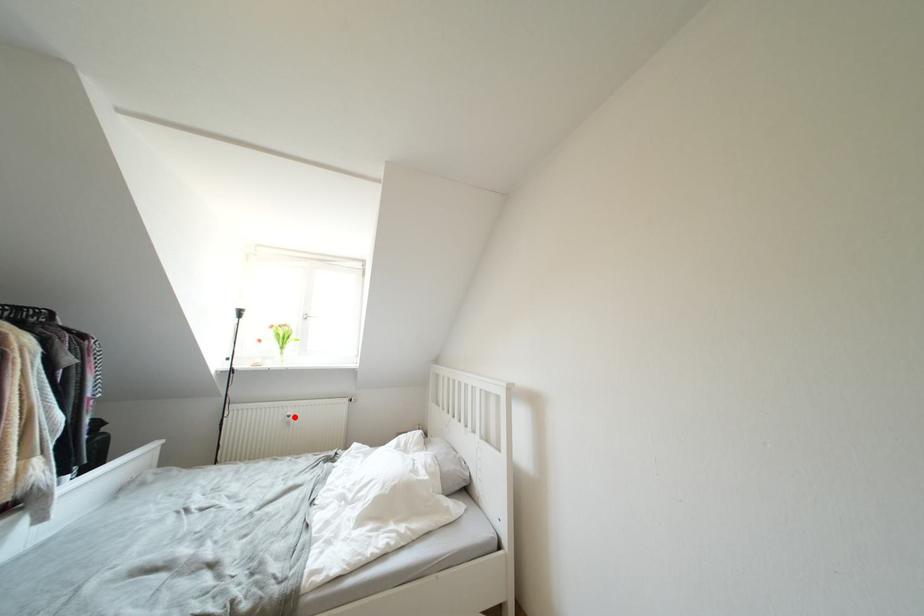
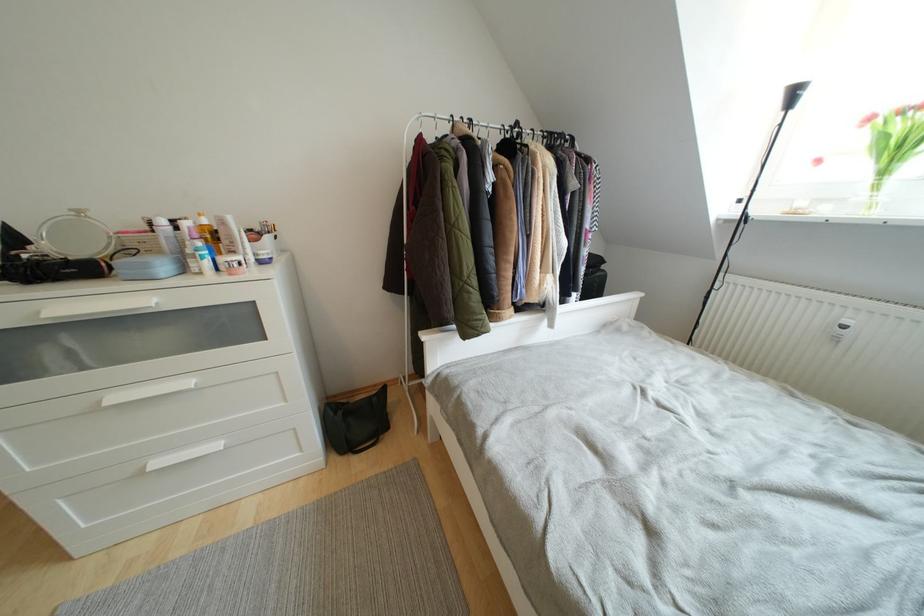
Where in the second image is the point corresponding to the highlighted location from the first image?

(853, 326)